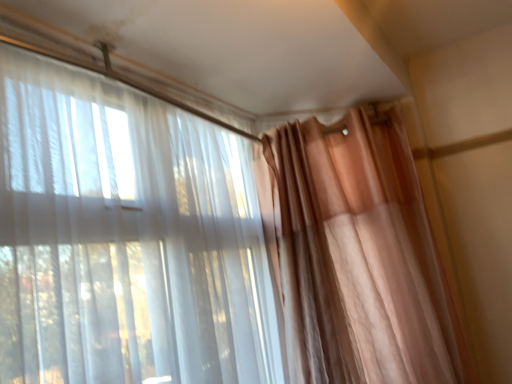
Question: Should I look upward or downward to see sheer white curtain at left, which ranks as the 2th curtain in right-to-left order?

Choices:
 (A) down
 (B) up

Answer: (A)

Question: Does sheer white curtain at left, which ranks as the 2th curtain in right-to-left order, have a greater width compared to matte peach curtain at right, positioned as the 2th curtain in left-to-right order?

Choices:
 (A) yes
 (B) no

Answer: (B)

Question: Would you say sheer white curtain at left, the 1th curtain from the left, is outside matte peach curtain at right, positioned as the 1th curtain in right-to-left order?

Choices:
 (A) no
 (B) yes

Answer: (B)

Question: Does sheer white curtain at left, the 1th curtain from the left, have a lesser width compared to matte peach curtain at right, positioned as the 2th curtain in left-to-right order?

Choices:
 (A) yes
 (B) no

Answer: (A)

Question: From the image's perspective, is sheer white curtain at left, which ranks as the 2th curtain in right-to-left order, over matte peach curtain at right, positioned as the 1th curtain in right-to-left order?

Choices:
 (A) no
 (B) yes

Answer: (B)

Question: Are sheer white curtain at left, which ranks as the 2th curtain in right-to-left order, and matte peach curtain at right, positioned as the 2th curtain in left-to-right order, beside each other?

Choices:
 (A) no
 (B) yes

Answer: (A)

Question: Considering the relative positions of sheer white curtain at left, the 1th curtain from the left, and matte peach curtain at right, positioned as the 1th curtain in right-to-left order, in the image provided, is sheer white curtain at left, the 1th curtain from the left, behind matte peach curtain at right, positioned as the 1th curtain in right-to-left order,?

Choices:
 (A) yes
 (B) no

Answer: (B)

Question: Is matte peach curtain at right, positioned as the 2th curtain in left-to-right order, thinner than sheer white curtain at left, the 1th curtain from the left?

Choices:
 (A) no
 (B) yes

Answer: (A)

Question: From the image's perspective, does matte peach curtain at right, positioned as the 1th curtain in right-to-left order, appear lower than sheer white curtain at left, the 1th curtain from the left?

Choices:
 (A) no
 (B) yes

Answer: (B)

Question: Is sheer white curtain at left, which ranks as the 2th curtain in right-to-left order, at the back of matte peach curtain at right, positioned as the 1th curtain in right-to-left order?

Choices:
 (A) yes
 (B) no

Answer: (B)

Question: From the image's perspective, does matte peach curtain at right, positioned as the 2th curtain in left-to-right order, appear higher than sheer white curtain at left, the 1th curtain from the left?

Choices:
 (A) no
 (B) yes

Answer: (A)

Question: Does matte peach curtain at right, positioned as the 2th curtain in left-to-right order, come behind sheer white curtain at left, which ranks as the 2th curtain in right-to-left order?

Choices:
 (A) no
 (B) yes

Answer: (B)

Question: Is matte peach curtain at right, positioned as the 1th curtain in right-to-left order, shorter than sheer white curtain at left, which ranks as the 2th curtain in right-to-left order?

Choices:
 (A) no
 (B) yes

Answer: (A)

Question: In the image, is sheer white curtain at left, which ranks as the 2th curtain in right-to-left order, positioned in front of or behind matte peach curtain at right, positioned as the 1th curtain in right-to-left order?

Choices:
 (A) behind
 (B) front

Answer: (B)